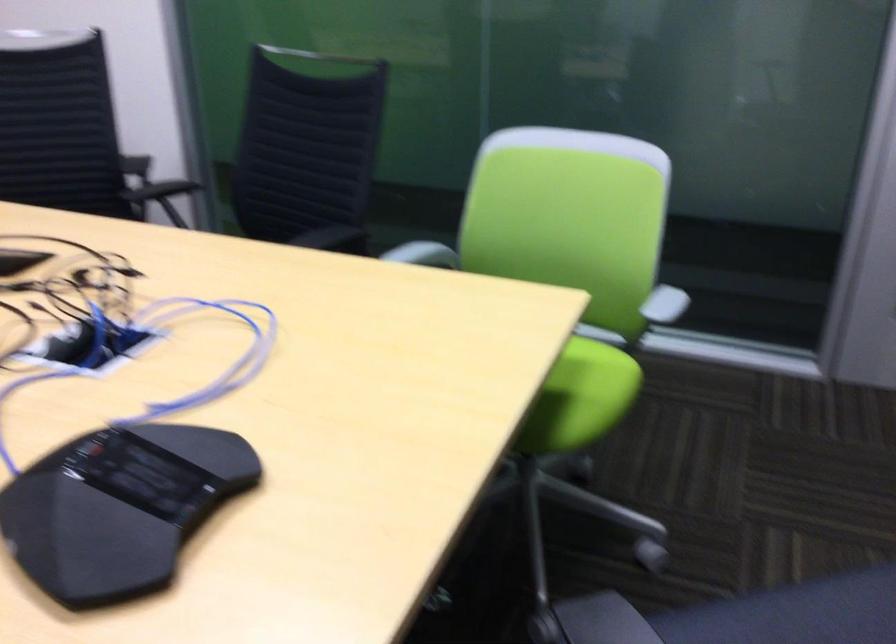
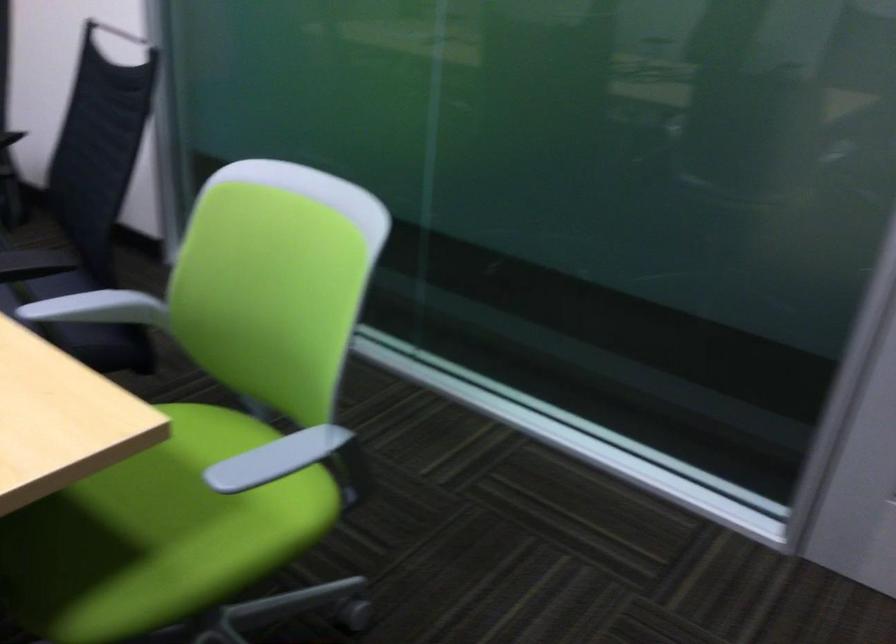
Locate, in the second image, the point that corresponds to (549,386) in the first image.

(157, 534)